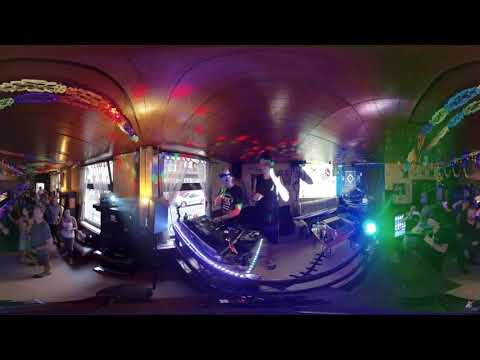
Where is `light`? light is located at coordinates (372, 225).